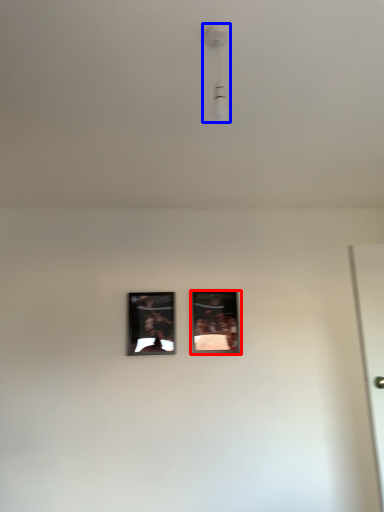
Question: Among these objects, which one is nearest to the camera, picture frame (highlighted by a red box) or light fixture (highlighted by a blue box)?

Choices:
 (A) picture frame
 (B) light fixture

Answer: (B)